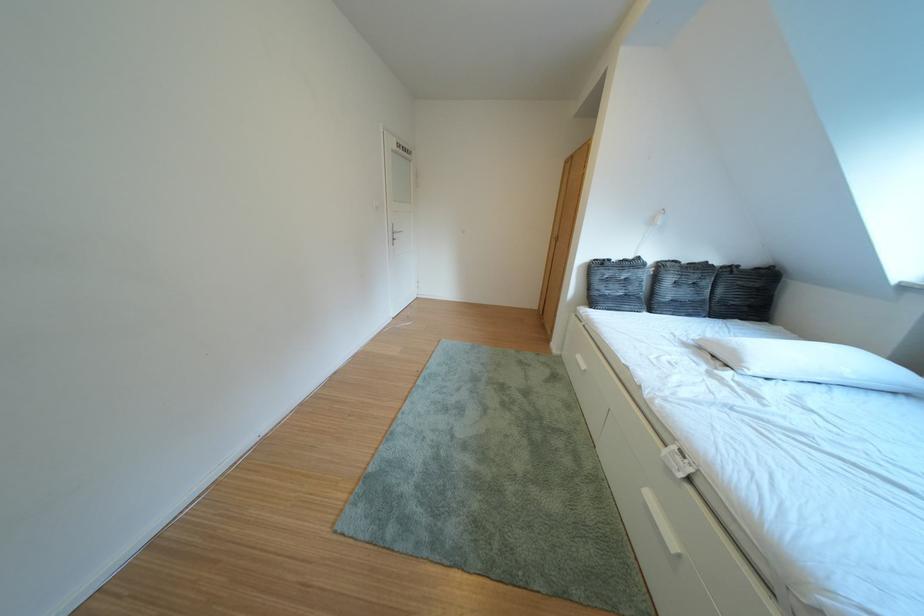
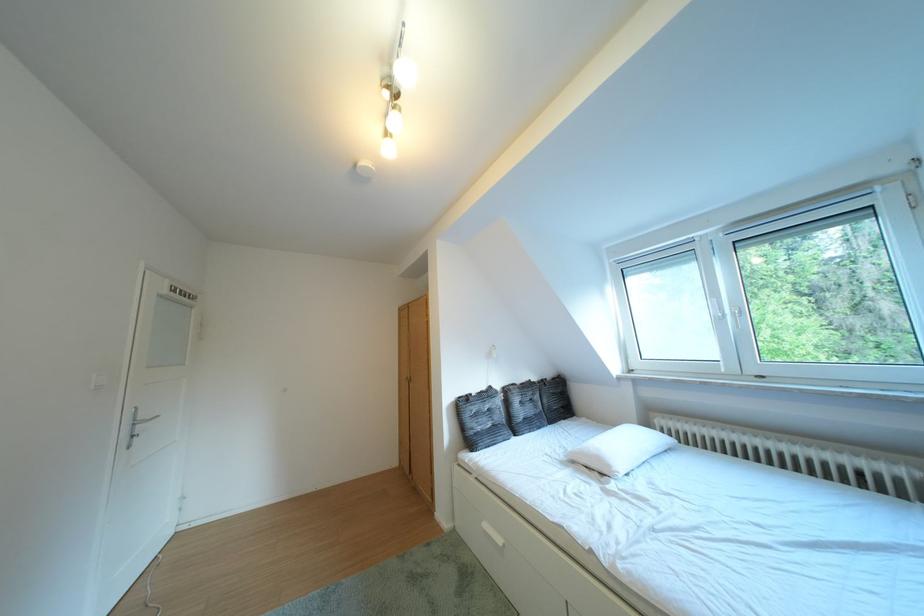
In the second image, find the point that corresponds to (x=610, y=299) in the first image.

(484, 438)